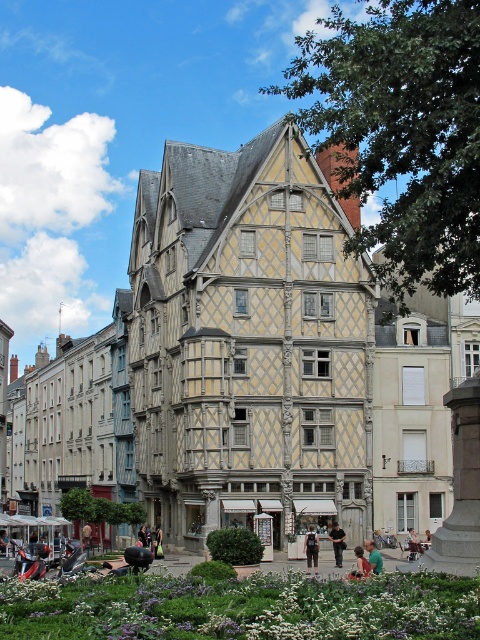
Can you confirm if green fabric shirt at lower center is positioned below green fabric chair at center?

Actually, green fabric shirt at lower center is above green fabric chair at center.

The height and width of the screenshot is (640, 480). Find the location of `green fabric shirt at lower center`. green fabric shirt at lower center is located at coordinates (373, 556).

Does point (322, 371) come closer to viewer compared to point (372, 545)?

No, (322, 371) is further to viewer.

In the scene shown: Does wooden half-timbered building at center have a larger size compared to green fabric shirt at lower center?

Indeed, wooden half-timbered building at center has a larger size compared to green fabric shirt at lower center.

Who is more forward, (352, 266) or (376, 563)?

Point (376, 563) is more forward.

The height and width of the screenshot is (640, 480). What are the coordinates of `wooden half-timbered building at center` in the screenshot? It's located at (251, 364).

Between wooden half-timbered building at center and dark blue jeans at lower center, which one is positioned lower?

dark blue jeans at lower center is lower down.

Looking at this image, is wooden half-timbered building at center to the right of dark blue jeans at lower center from the viewer's perspective?

In fact, wooden half-timbered building at center is to the left of dark blue jeans at lower center.

The image size is (480, 640). Identify the location of wooden half-timbered building at center. (251, 364).

The height and width of the screenshot is (640, 480). I want to click on wooden half-timbered building at center, so click(251, 364).